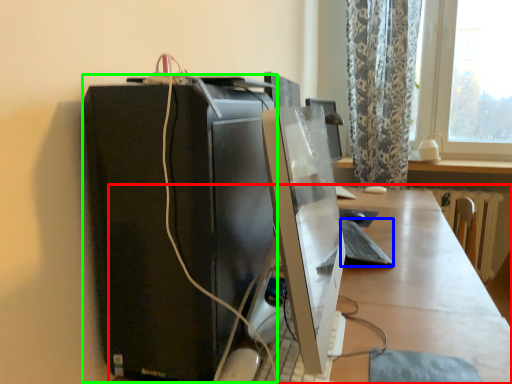
Question: Estimate the real-world distances between objects in this image. Which object is farther from desk (highlighted by a red box), computer keyboard (highlighted by a blue box) or computer tower (highlighted by a green box)?

Choices:
 (A) computer keyboard
 (B) computer tower

Answer: (B)